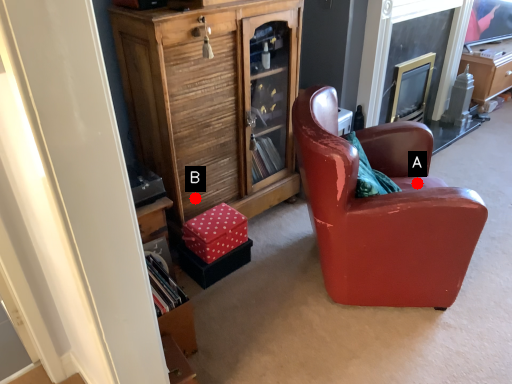
Question: Two points are circled on the image, labeled by A and B beside each circle. Among these points, which one is nearest to the camera?

Choices:
 (A) A is closer
 (B) B is closer

Answer: (A)